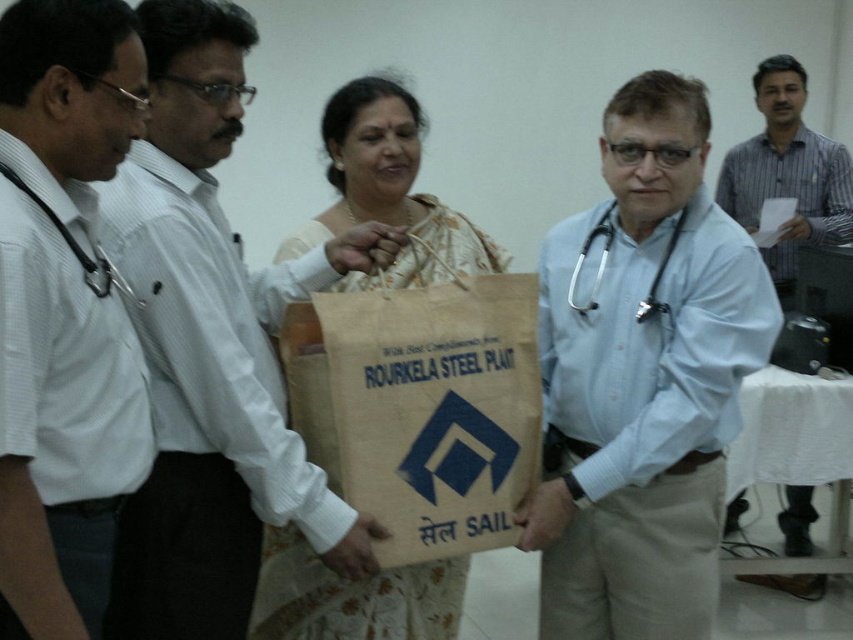
Consider the image. Does matte white shirt at center have a lesser width compared to brown paper bag at center?

Yes.

Which is more to the left, matte white shirt at center or brown paper bag at center?

Positioned to the left is matte white shirt at center.

The width and height of the screenshot is (853, 640). I want to click on matte white shirt at center, so click(x=212, y=349).

Between beige fabric saree at center and black rubber stethoscope at center, which one is positioned lower?

Positioned lower is black rubber stethoscope at center.

Is point (360, 177) closer to camera compared to point (675, 224)?

No, it is behind (675, 224).

Image resolution: width=853 pixels, height=640 pixels. Find the location of `beige fabric saree at center`. beige fabric saree at center is located at coordinates (389, 189).

Is point (393, 193) behind point (769, 58)?

No, it is not.

Between beige fabric saree at center and white shirt at center, which one has more height?

With more height is white shirt at center.

The width and height of the screenshot is (853, 640). I want to click on beige fabric saree at center, so click(389, 189).